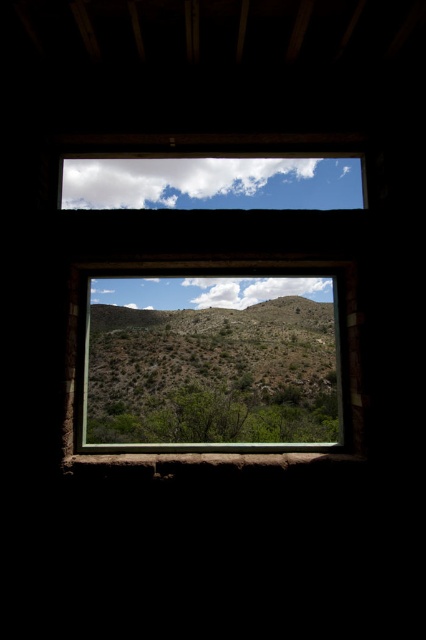
Between rustic wooden frame at center and green leafy tree at center, which one has more height?

rustic wooden frame at center is taller.

Can you confirm if rustic wooden frame at center is positioned to the right of green leafy tree at center?

Indeed, rustic wooden frame at center is positioned on the right side of green leafy tree at center.

Which is behind, point (176, 289) or point (210, 433)?

The point (176, 289) is behind.

This screenshot has width=426, height=640. Find the location of `rustic wooden frame at center`. rustic wooden frame at center is located at coordinates (216, 310).